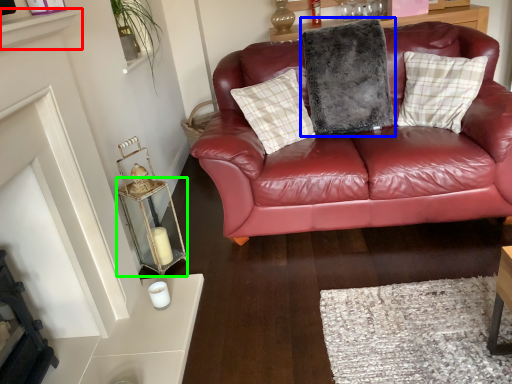
Question: Based on their relative distances, which object is farther from shelf (highlighted by a red box)? Choose from pillow (highlighted by a blue box) and table (highlighted by a green box).

Choices:
 (A) pillow
 (B) table

Answer: (A)